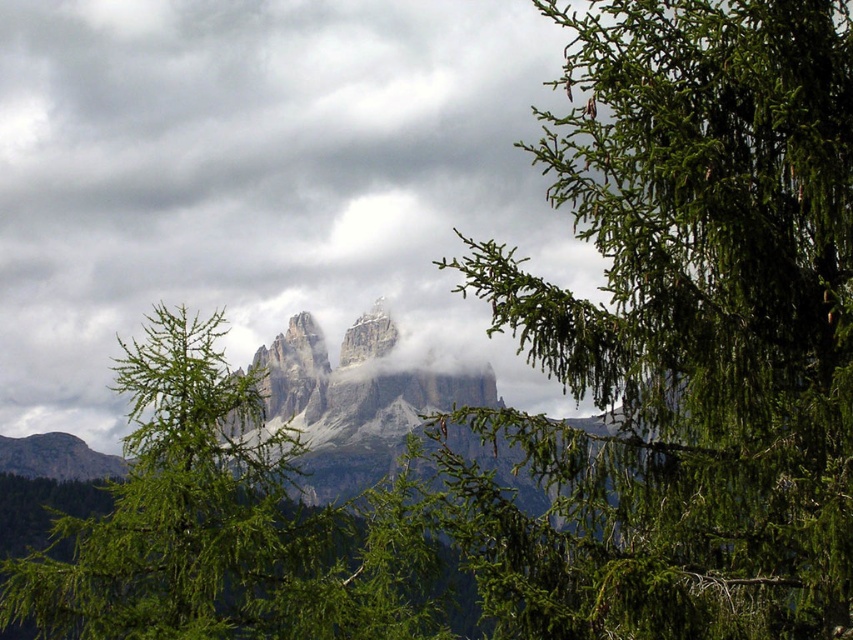
Question: Is green needle-like branches at upper right positioned behind green needle-like tree at center?

Choices:
 (A) no
 (B) yes

Answer: (A)

Question: Which point is farther from the camera taking this photo?

Choices:
 (A) (498, 417)
 (B) (375, 632)

Answer: (B)

Question: Which point is closer to the camera taking this photo?

Choices:
 (A) tap(126, 573)
 (B) tap(616, 140)

Answer: (B)

Question: Which point is farther from the camera taking this photo?

Choices:
 (A) (177, 442)
 (B) (630, 10)

Answer: (A)

Question: Can you confirm if green needle-like branches at upper right is smaller than green needle-like tree at center?

Choices:
 (A) no
 (B) yes

Answer: (A)

Question: Is green needle-like branches at upper right to the right of green needle-like tree at center from the viewer's perspective?

Choices:
 (A) yes
 (B) no

Answer: (A)